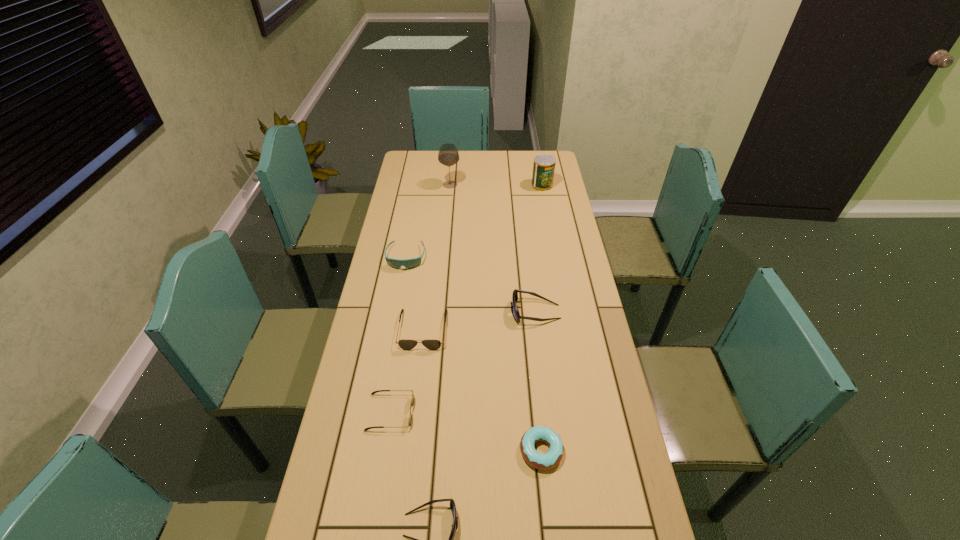
Where is `blue doughnut`? blue doughnut is located at coordinates (543, 461).

Locate an element on the screen. Image resolution: width=960 pixels, height=540 pixels. free space located 0.250m on the back of the tallest object is located at coordinates (453, 153).

Identify the location of vacant region located on the front of the second tallest object. The image size is (960, 540). (549, 225).

Locate an element on the screen. The image size is (960, 540). free spot located 0.240m on the front-facing side of the tallest sunglasses is located at coordinates (439, 312).

Identify the location of free spot located 0.160m on the front-facing side of the tallest sunglasses. The width and height of the screenshot is (960, 540). coord(463,312).

The image size is (960, 540). I want to click on free space located 0.310m on the front-facing side of the tallest sunglasses, so click(x=419, y=312).

Find the location of a particular element. vacant point located on the front-facing side of the farthest sunglasses is located at coordinates (391, 342).

Locate an element on the screen. The width and height of the screenshot is (960, 540). free space located 0.360m on the front-facing side of the bigger black sunglasses is located at coordinates (406, 466).

The width and height of the screenshot is (960, 540). Find the location of `free spot located 0.140m on the front-facing side of the shortest sunglasses`. free spot located 0.140m on the front-facing side of the shortest sunglasses is located at coordinates (464, 412).

Locate an element on the screen. This screenshot has height=540, width=960. vacant space positioned on the left of the doughnut is located at coordinates (489, 450).